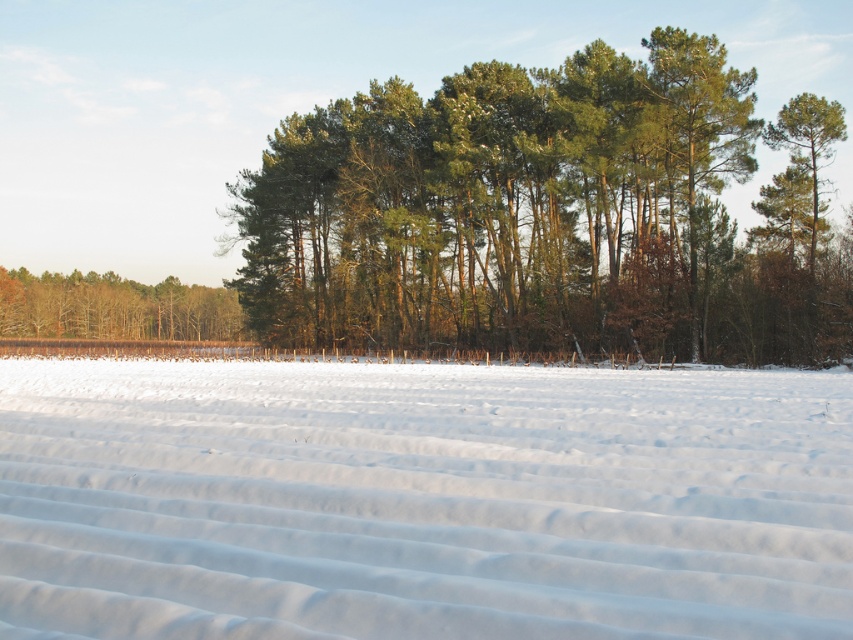
You are an observer standing in the snowy field. You notice the white smooth snow at center and the green textured trees at center. Which object is taller from your viewpoint?

The green textured trees at center are taller than the white smooth snow at center.

You are standing at the origin point in the winter landscape. The coordinates of the green textured trees at center are given. Can you determine their position relative to the fence or row of posts in the midground?

The green textured trees at center are located at coordinates point (546,214). Since the fence or row of posts is in the midground, which is between the foreground and background, and the trees are in the background, the trees are behind the fence or row of posts.

You are an observer standing in the snowy field. You notice the white smooth snow at center and the green textured trees at center. Which object appears closer to you?

The white smooth snow at center appears closer to you because it has a smaller size compared to the green textured trees at center, indicating it is nearer in the scene.